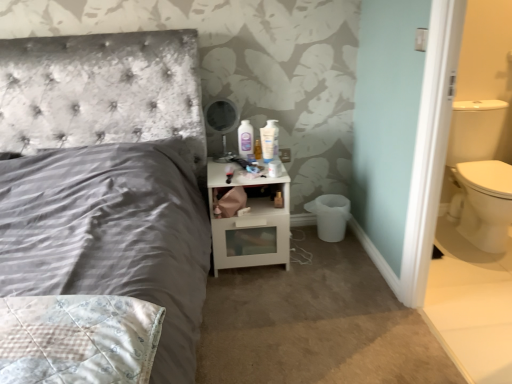
Question: Considering the positions of white glossy nightstand at center and white matte toilet paper at lower right in the image, is white glossy nightstand at center wider or thinner than white matte toilet paper at lower right?

Choices:
 (A) thin
 (B) wide

Answer: (B)

Question: Would you say white glossy nightstand at center is to the left or to the right of white matte toilet paper at lower right in the picture?

Choices:
 (A) left
 (B) right

Answer: (B)

Question: Which object is positioned closest to the white glossy nightstand at center?

Choices:
 (A) white glossy mouthwash at upper center
 (B) white matte toilet paper at lower right

Answer: (B)

Question: Estimate the real-world distances between objects in this image. Which object is closer to the white glossy mouthwash at upper center?

Choices:
 (A) white glossy nightstand at center
 (B) white matte toilet paper at lower right

Answer: (A)